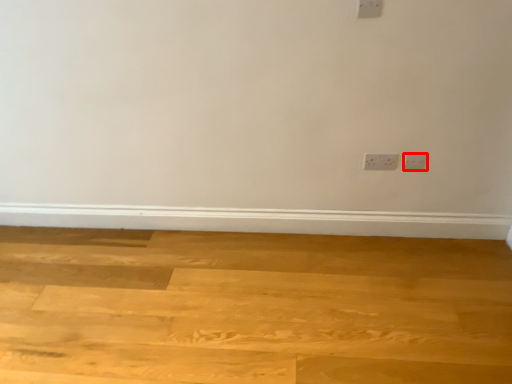
Question: In this image, where is power plugs and sockets (annotated by the red box) located relative to plywood?

Choices:
 (A) left
 (B) right

Answer: (B)